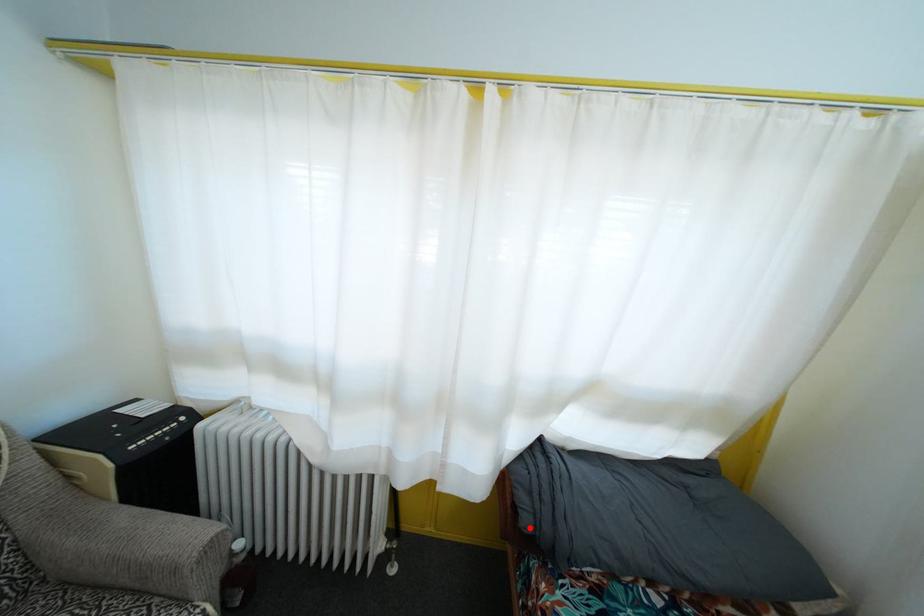
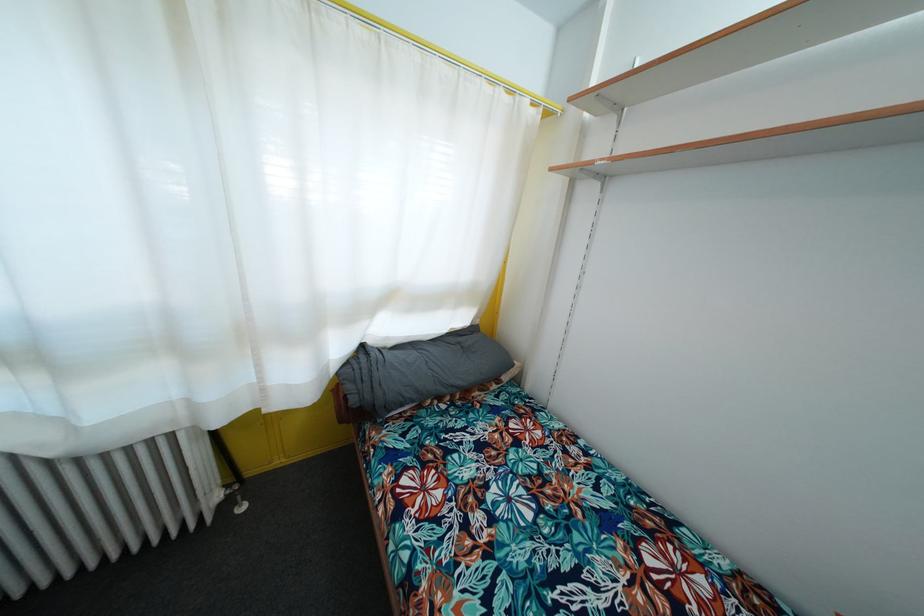
In the second image, find the point that corresponds to the highlighted location in the first image.

(358, 407)